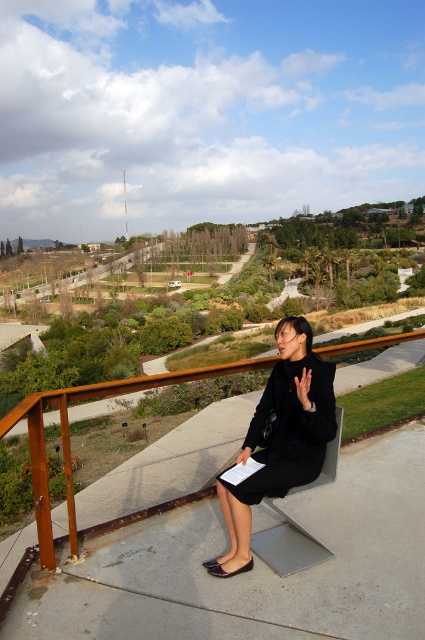
You are a photographer trying to capture the black matte dress at center in your shot. The camera you are using has a focal length of 50mm. If the point where the dress is located is at point (x=280, y=438), can you estimate the dress position relative to the camera frame?

The black matte dress at center is located at point (x=280, y=438), which means it is positioned approximately 68.6 percent from the left edge and 65.9 percent from the top edge of the camera frame. This places the dress slightly to the right and lower middle of the frame.

Where is the black matte dress at center located in the image?

The black matte dress at center is located at point (280,438).